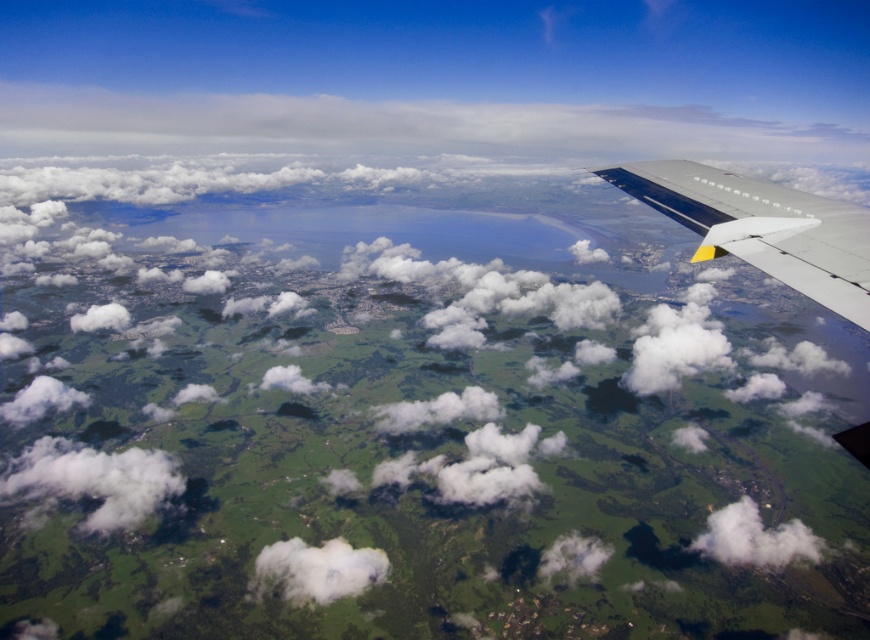
You are a pilot flying at an altitude of 10,000 feet. You notice a point of interest at coordinates point (293,579). If the point is 1548.77 feet away from the camera, can you estimate how far it is from the airplane in total?

The point (293,579) is 1548.77 feet from the camera, so the total distance from the airplane would be approximately 1548.77 feet.

You are a passenger on the airplane and want to take a photo of the white fluffy cloud at lower right. However, you notice the white matte wing at upper right might block your view. Based on the scene, will the wing block the cloud in your photo?

The white matte wing at upper right is positioned on the left side of the white fluffy cloud at lower right, so it will not block the view of the cloud in your photo.

Based on the photo, you are a passenger on the plane and want to know if the white matte wing at upper right is wider than the white fluffy cloud at lower right. Based on the view from the airplane window, can you determine which one is wider?

The white matte wing at upper right has a lesser width compared to the white fluffy cloud at lower right, so the cloud is wider.